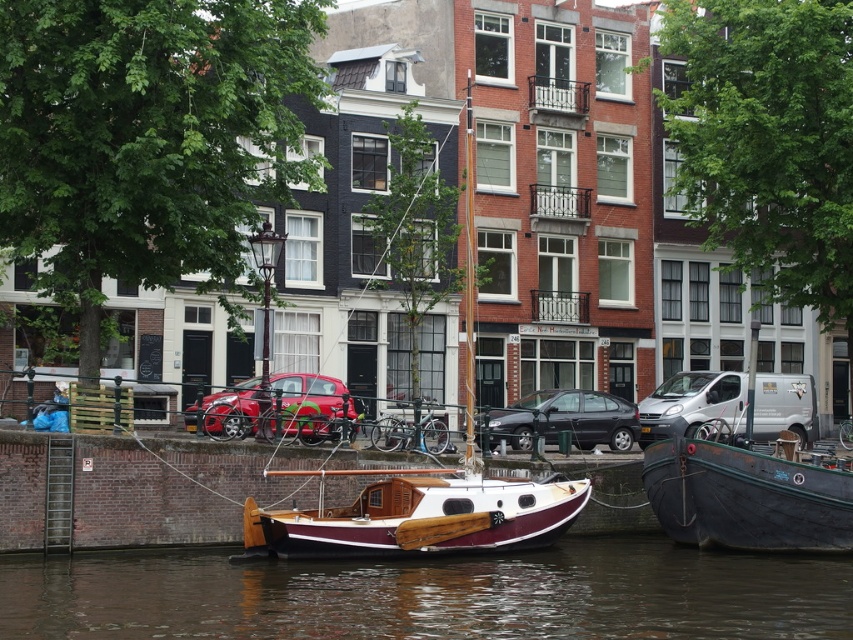
From the picture: You are standing on a bridge overlooking the brown water at center and the metallic red car at center. Which object is nearer to you?

The brown water at center is closer to the viewer than the metallic red car at center.

You are a tourist in this European canal city and want to take a photo of both the brown water at center and the metallic red car at center. Since you can only focus on one object at a time, which one should you focus on to ensure the other is still in the frame?

You should focus on the metallic red car at center because the brown water at center is positioned on the right side of it, so keeping the car centered will keep the water within the frame.